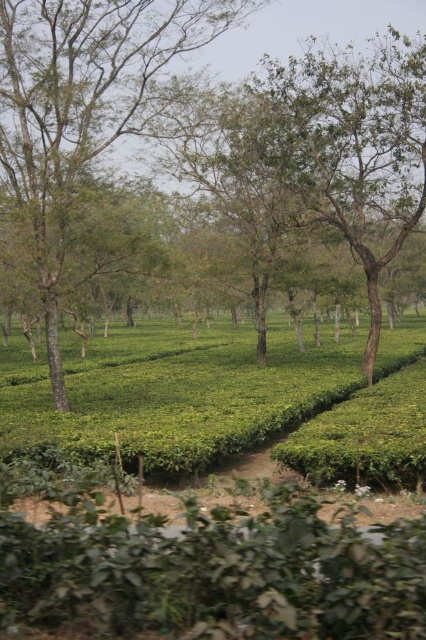
Question: Among these objects, which one is farthest from the camera?

Choices:
 (A) green leafy hedge at lower center
 (B) green leafy tree at center

Answer: (B)

Question: Is green leafy hedge at lower center above green leafy tree at center?

Choices:
 (A) no
 (B) yes

Answer: (A)

Question: Observing the image, what is the correct spatial positioning of green leafy hedge at lower center in reference to green leafy tree at center?

Choices:
 (A) above
 (B) below

Answer: (B)

Question: Can you confirm if green leafy hedge at lower center is positioned to the right of green leafy tree at center?

Choices:
 (A) yes
 (B) no

Answer: (A)

Question: Which point is farther to the camera?

Choices:
 (A) green leafy hedge at lower center
 (B) green leafy tree at center

Answer: (B)